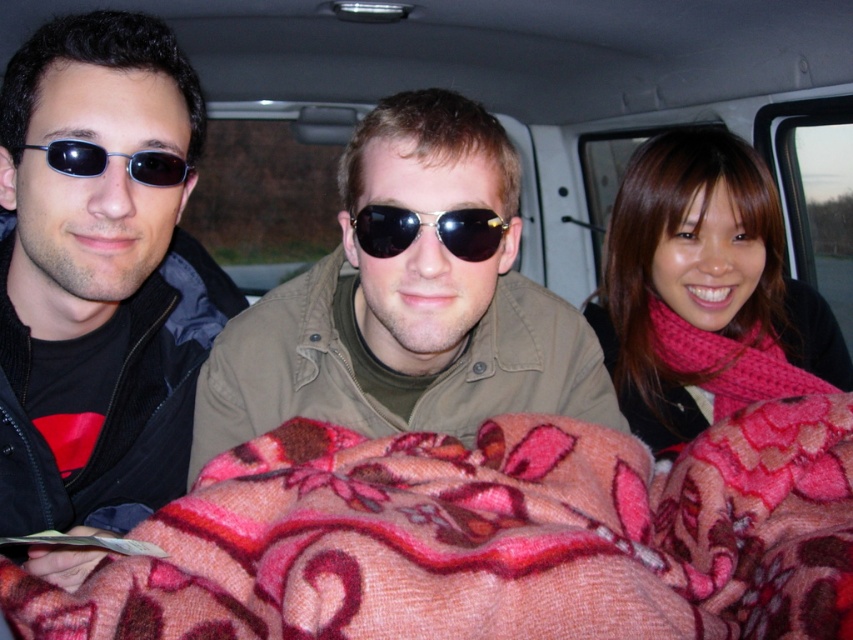
Question: Considering the relative positions of matte black jacket at left and gold reflective sunglasses at center in the image provided, where is matte black jacket at left located with respect to gold reflective sunglasses at center?

Choices:
 (A) below
 (B) above

Answer: (A)

Question: Is matte black jacket at left thinner than gold reflective sunglasses at center?

Choices:
 (A) no
 (B) yes

Answer: (A)

Question: Which object appears closest to the camera in this image?

Choices:
 (A) fluffy pink blanket at center
 (B) matte black sunglasses at left
 (C) matte brown jacket at center
 (D) pink knitted scarf at upper right

Answer: (A)

Question: Which of the following is the closest to the observer?

Choices:
 (A) (154, 620)
 (B) (86, 154)
 (C) (396, 228)

Answer: (A)

Question: Considering the real-world distances, which object is farthest from the matte black sunglasses at left?

Choices:
 (A) matte brown jacket at center
 (B) pink knitted scarf at upper right

Answer: (B)

Question: Considering the relative positions of matte brown jacket at center and matte black sunglasses at left in the image provided, where is matte brown jacket at center located with respect to matte black sunglasses at left?

Choices:
 (A) right
 (B) left

Answer: (A)